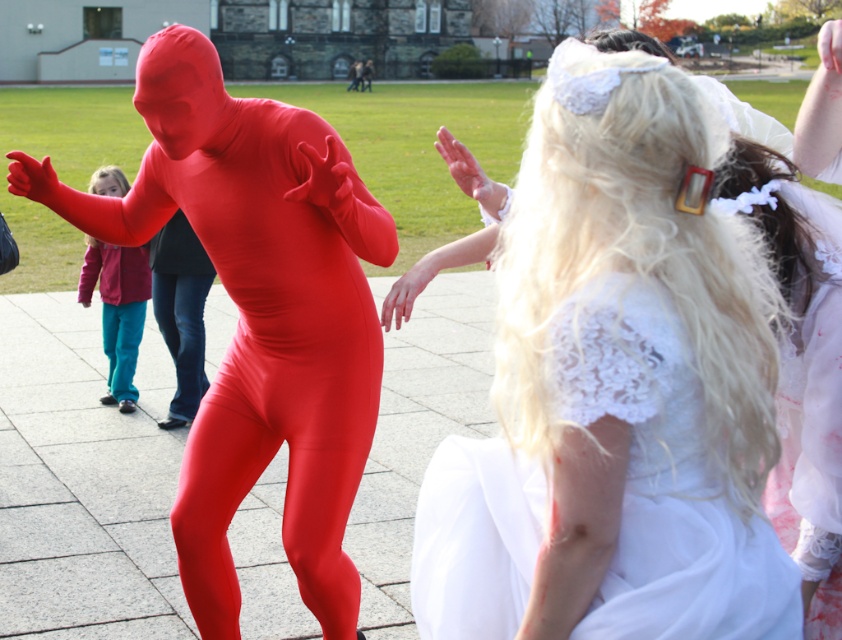
Is white lace dress at upper right below denim at left?

Yes, white lace dress at upper right is below denim at left.

Does white lace dress at upper right have a smaller size compared to denim at left?

Actually, white lace dress at upper right might be larger than denim at left.

Who is more forward, (x=680, y=337) or (x=174, y=337)?

Point (x=680, y=337) is more forward.

Locate an element on the screen. The height and width of the screenshot is (640, 842). white lace dress at upper right is located at coordinates (664, 477).

Does white lace dress at upper right appear over matte pink jacket at left?

No.

Can you confirm if white lace dress at upper right is thinner than matte pink jacket at left?

Incorrect, white lace dress at upper right's width is not less than matte pink jacket at left's.

Is point (677, 467) positioned after point (132, 348)?

No.

What are the coordinates of `white lace dress at upper right` in the screenshot? It's located at (664, 477).

Does matte pink jacket at left have a larger size compared to denim at left?

Correct, matte pink jacket at left is larger in size than denim at left.

Image resolution: width=842 pixels, height=640 pixels. Identify the location of matte pink jacket at left. (116, 310).

Who is more forward, (113,289) or (195,358)?

Point (195,358)

Identify the location of matte pink jacket at left. This screenshot has width=842, height=640. [116, 310].